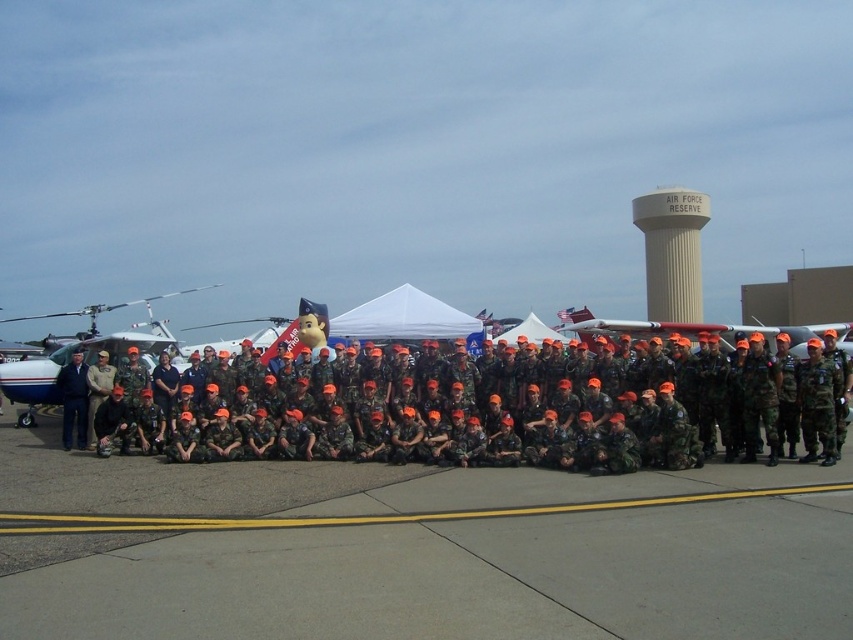
Does gray asphalt tarmac at center lie in front of beige concrete water tower at upper center?

Yes.

Who is lower down, gray asphalt tarmac at center or beige concrete water tower at upper center?

gray asphalt tarmac at center

Is point (668, 513) closer to camera compared to point (674, 243)?

Yes, it is in front of point (674, 243).

Locate an element on the screen. This screenshot has height=640, width=853. gray asphalt tarmac at center is located at coordinates click(415, 548).

Between point (651, 570) and point (83, 312), which one is positioned behind?

Positioned behind is point (83, 312).

Is point (428, 561) farther from camera compared to point (79, 310)?

That is False.

At what (x,y) coordinates should I click in order to perform the action: click on gray asphalt tarmac at center. Please return your answer as a coordinate pair (x, y). Image resolution: width=853 pixels, height=640 pixels. Looking at the image, I should click on (415, 548).

Can you confirm if camouflage uniform at center is taller than beige concrete water tower at upper center?

Incorrect, camouflage uniform at center's height is not larger of beige concrete water tower at upper center's.

Can you confirm if camouflage uniform at center is thinner than beige concrete water tower at upper center?

Incorrect, camouflage uniform at center's width is not less than beige concrete water tower at upper center's.

The height and width of the screenshot is (640, 853). What do you see at coordinates (410, 429) in the screenshot?
I see `camouflage uniform at center` at bounding box center [410, 429].

This screenshot has width=853, height=640. Find the location of `camouflage uniform at center`. camouflage uniform at center is located at coordinates (410, 429).